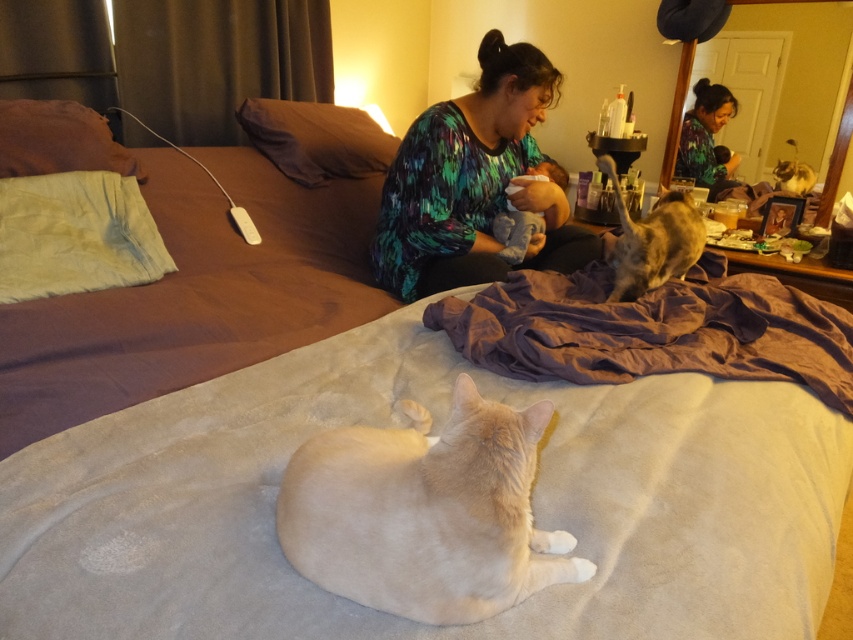
Question: Among these points, which one is nearest to the camera?

Choices:
 (A) (706, 364)
 (B) (126, 628)

Answer: (B)

Question: Is white fabric pillow at upper left to the right of brown fabric pillow at upper left from the viewer's perspective?

Choices:
 (A) yes
 (B) no

Answer: (A)

Question: Which of the following is the farthest from the observer?

Choices:
 (A) (697, 179)
 (B) (762, 600)
 (C) (30, 145)
 (D) (604, 161)

Answer: (A)

Question: Which object appears closest to the camera in this image?

Choices:
 (A) tabby fur cat at upper right
 (B) brown fabric pillow at upper center

Answer: (A)

Question: Is purple soft fabric at center bigger than brown fabric pillow at upper left?

Choices:
 (A) yes
 (B) no

Answer: (A)

Question: Does light beige fur cat at lower center appear over brown fabric pillow at upper left?

Choices:
 (A) yes
 (B) no

Answer: (B)